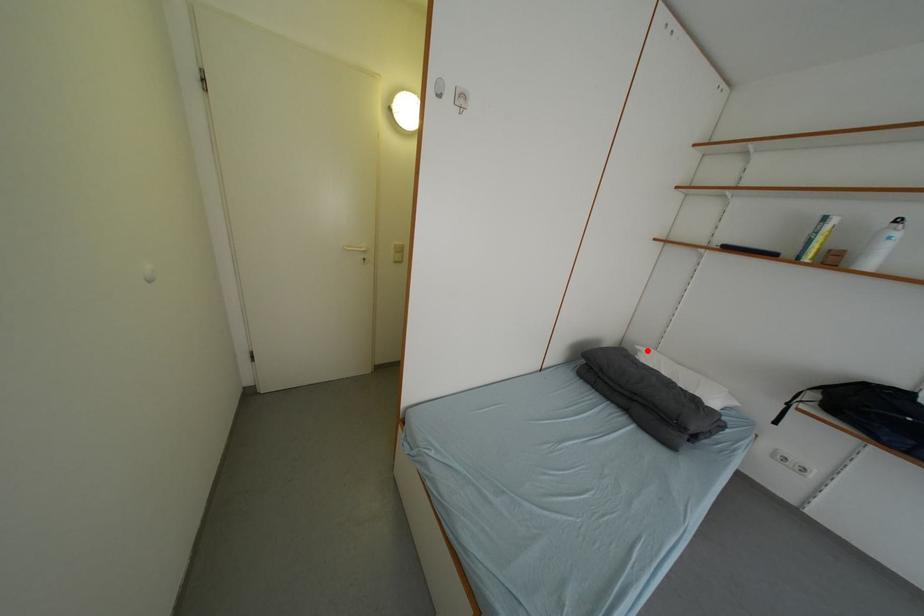
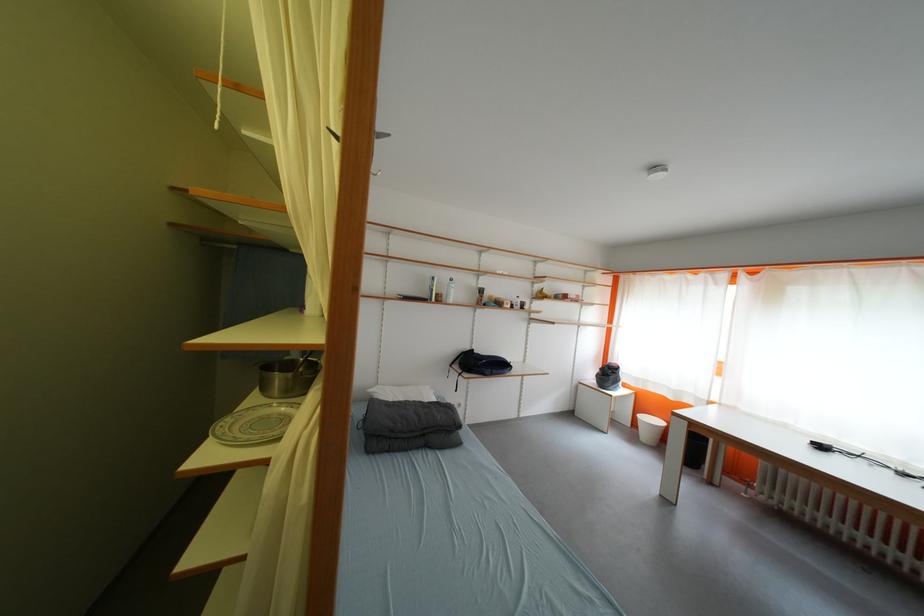
Locate, in the second image, the point that corresponds to the highlighted location in the first image.

(380, 392)